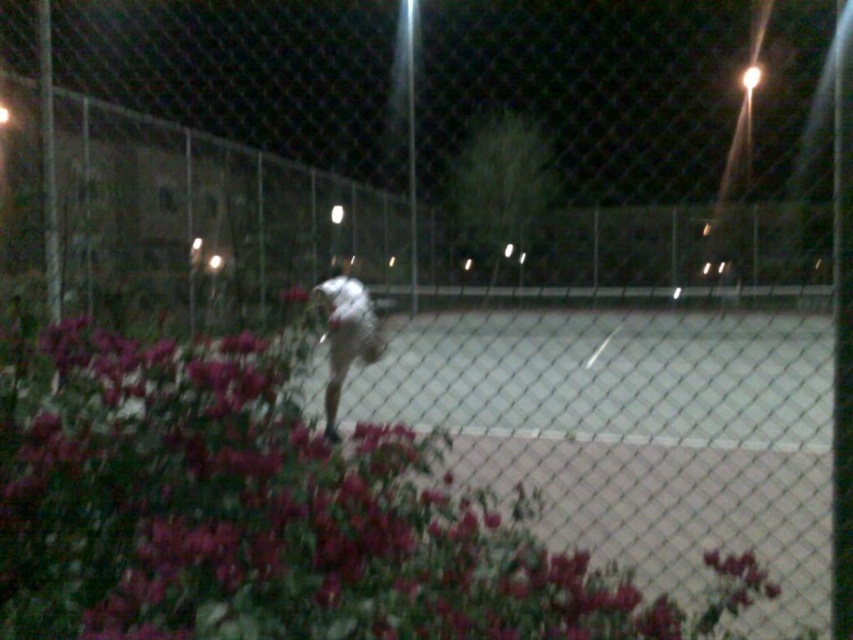
You are standing at the edge of the tennis court and notice the purple matte flowers at center. If you want to place a small decorative pot that is 1.5 meters tall next to them, will it be visible from your current position?

The purple matte flowers at center are 1.51 meters away from the viewer. Since the decorative pot is 1.5 meters tall, it will be slightly shorter than the distance to the flowers, so it should still be visible from your current position as long as there are no obstructions.

You are a photographer trying to capture the white fabric shirt at center and the purple matte flowers at center in a single shot. Based on their positions, which object should you adjust your camera focus to first to ensure both are in frame?

The purple matte flowers at center is positioned on the right side of white fabric shirt at center, so you should focus on the white fabric shirt at center first to ensure both are within the frame.